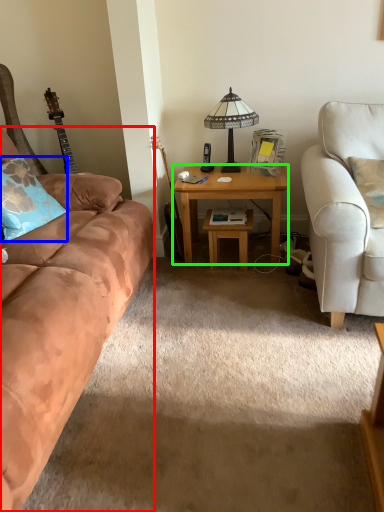
Question: Which object is positioned farthest from studio couch (highlighted by a red box)? Select from pillow (highlighted by a blue box) and desk (highlighted by a green box).

Choices:
 (A) pillow
 (B) desk

Answer: (B)